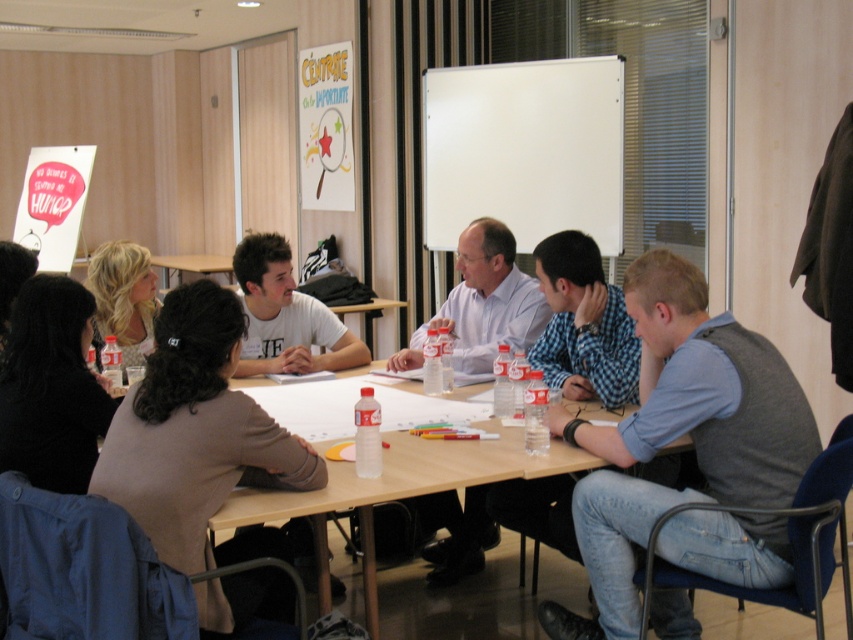
Question: Is the position of wooden table at center less distant than that of matte white shirt at center?

Choices:
 (A) no
 (B) yes

Answer: (B)

Question: Observing the image, what is the correct spatial positioning of matte white shirt at center in reference to white matte t-shirt at center?

Choices:
 (A) right
 (B) left

Answer: (A)

Question: Which point is farther from the camera taking this photo?

Choices:
 (A) tap(0, 451)
 (B) tap(352, 474)

Answer: (B)

Question: From the image, what is the correct spatial relationship of matte white shirt at center in relation to white matte t-shirt at center?

Choices:
 (A) below
 (B) above

Answer: (B)

Question: Among these points, which one is nearest to the camera?

Choices:
 (A) (465, 284)
 (B) (193, 308)
 (C) (10, 406)
 (D) (325, 566)

Answer: (B)

Question: Which object is positioned farthest from the gray sweater vest at center?

Choices:
 (A) wooden table at center
 (B) black sweater at left
 (C) white matte t-shirt at center
 (D) brown sweater at left

Answer: (B)